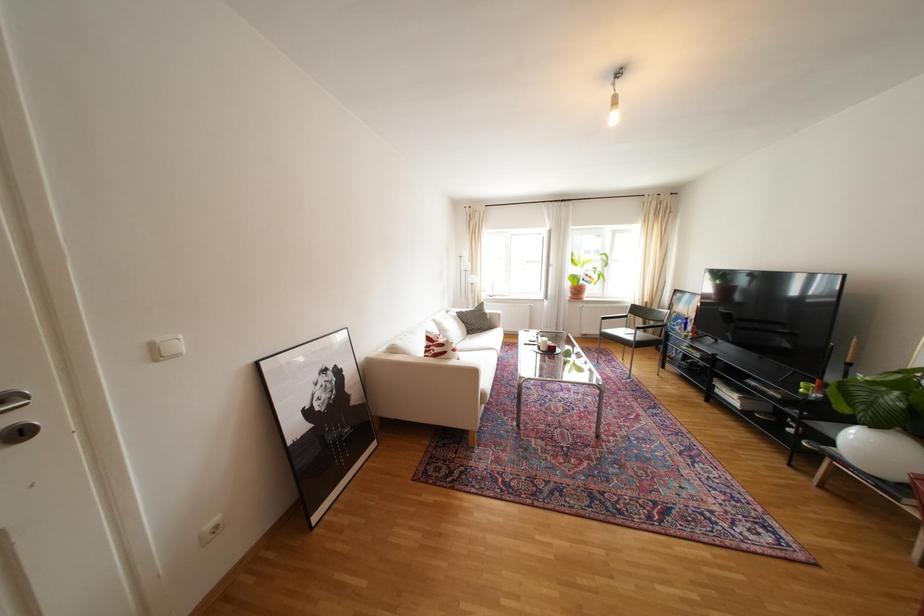
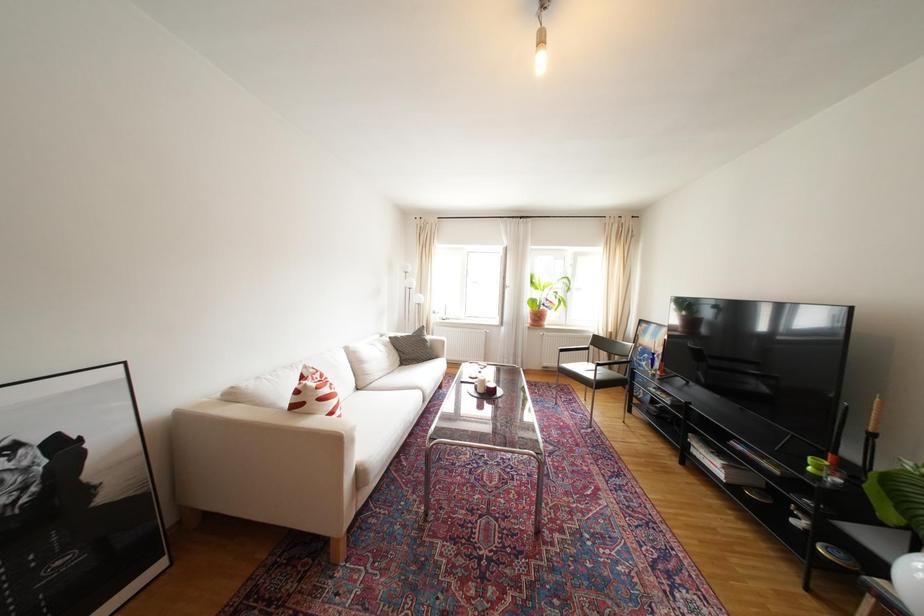
What movement of the cameraman would produce the second image?

The cameraman moved toward right, forward.